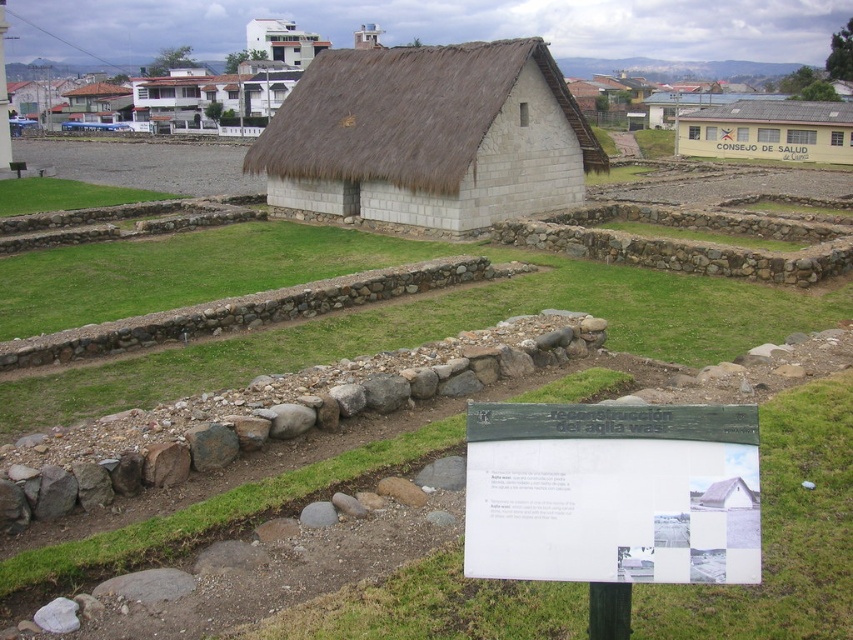
You are a tour guide explaining the archaeological site to visitors. Pointing to the white paper sign at center and the green grass at upper left, you want to describe their positions relative to each other. How would you phrase this?

The white paper sign at center is located below the green grass at upper left.

In the scene shown: You are a tour guide leading a group at the archaeological site. You want to point out both the thatched straw roof at center and the yellow paper sign at center to your visitors. Since you can only point in one direction, which object is closer to you so you can point to it without moving your hand?

The yellow paper sign at center is closer to you because it is at center, while the thatched straw roof at center is 43.28 meters away from the sign. Since you are likely standing near the sign, you can point to the yellow paper sign at center without moving your hand.